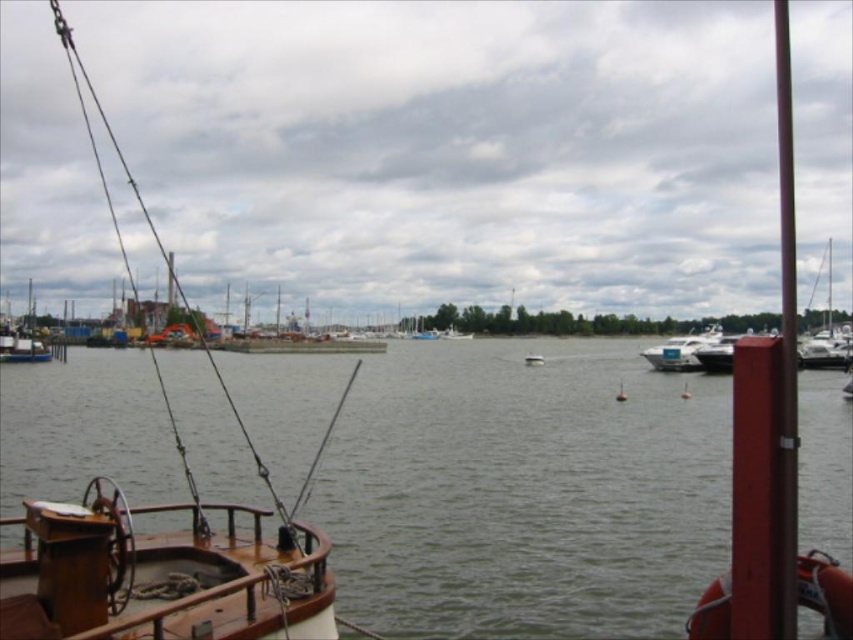
You are planning to transport a large cargo container that requires a boat wider than 10 meters. You see a wooden sailboat at left and a white plastic boat at center. Which boat can accommodate your cargo container?

The wooden sailboat at left has a greater width than the white plastic boat at center. Since the wooden sailboat at left is wider, it can accommodate the large cargo container requiring a boat wider than 10 meters.

You are a harbor inspector checking the height of vessels for a new bridge. You see the white plastic boat at center and the white glossy boat at center. Which one has a taller height?

The white plastic boat at center is much taller than the white glossy boat at center, so the white plastic boat at center has a taller height.